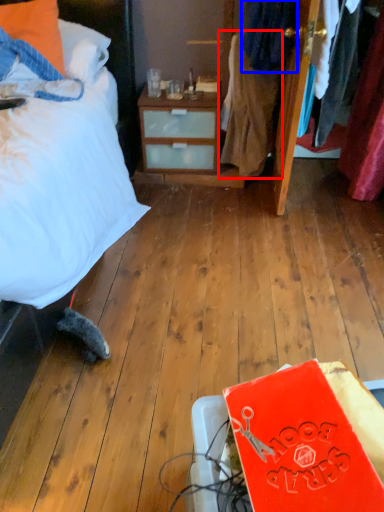
Question: Which point is closer to the camera, clothing (highlighted by a red box) or clothing (highlighted by a blue box)?

Choices:
 (A) clothing
 (B) clothing

Answer: (B)